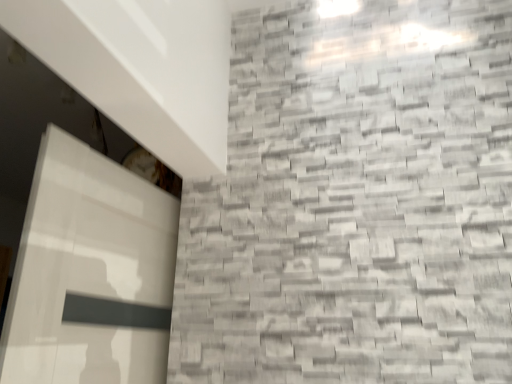
Describe the element at coordinates (141, 68) in the screenshot. I see `white glossy exhaust hood at upper left` at that location.

What is the approximate height of white glossy exhaust hood at upper left?

white glossy exhaust hood at upper left is 1.01 inches tall.

At what (x,y) coordinates should I click in order to perform the action: click on white glossy exhaust hood at upper left. Please return your answer as a coordinate pair (x, y). This screenshot has height=384, width=512. Looking at the image, I should click on (141, 68).

Measure the distance between point (160,74) and camera.

Point (160,74) and camera are 38.50 inches apart.

Find the location of a particular element. The image size is (512, 384). white glossy exhaust hood at upper left is located at coordinates tap(141, 68).